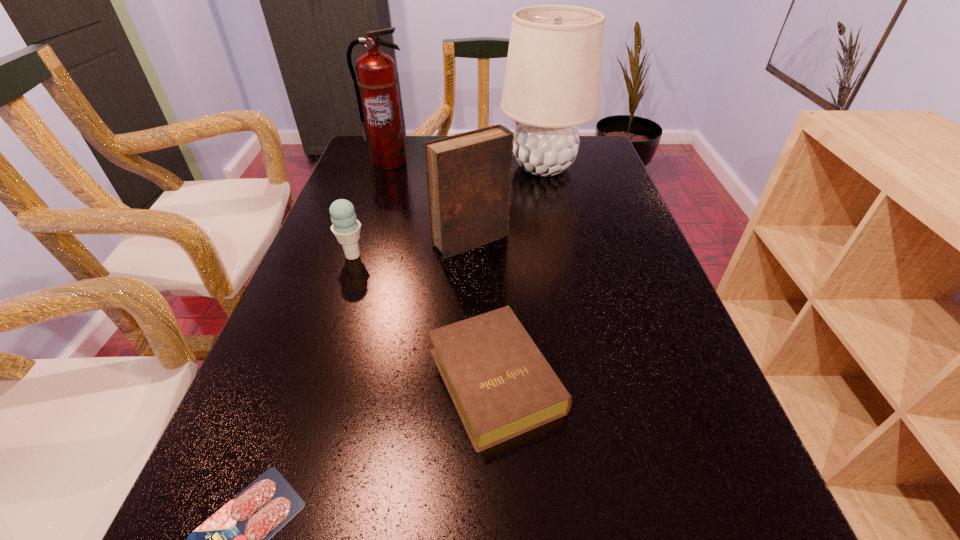
Locate an element on the screen. lampshade is located at coordinates (552, 80).

You are a GUI agent. You are given a task and a screenshot of the screen. Output one action in this format:
    pyautogui.click(x=<x>, y=<y>)
    Task: Click on the fire extinguisher
    The width and height of the screenshot is (960, 540).
    Given the screenshot: What is the action you would take?
    pyautogui.click(x=376, y=88)

The image size is (960, 540). What are the coordinates of `the taller Bible` in the screenshot? It's located at (468, 175).

Where is `the farther Bible`? This screenshot has height=540, width=960. the farther Bible is located at coordinates (468, 175).

Locate an element on the screen. The image size is (960, 540). ice cream is located at coordinates (346, 228).

This screenshot has height=540, width=960. Identify the location of the nearer Bible. (501, 385).

This screenshot has height=540, width=960. I want to click on the second nearest object, so click(501, 385).

This screenshot has height=540, width=960. I want to click on vacant space located 0.090m on the front of the lampshade, so click(x=552, y=207).

You are a GUI agent. You are given a task and a screenshot of the screen. Output one action in this format:
    pyautogui.click(x=<x>, y=<y>)
    Task: Click on the free space located on the side of the fire extinguisher with the handle and hose
    This screenshot has width=960, height=540.
    Given the screenshot: What is the action you would take?
    pyautogui.click(x=372, y=211)

You are a GUI agent. You are given a task and a screenshot of the screen. Output one action in this format:
    pyautogui.click(x=<x>, y=<y>)
    Task: Click on the free space located 0.230m on the left of the taller Bible
    
    Given the screenshot: What is the action you would take?
    pyautogui.click(x=339, y=241)